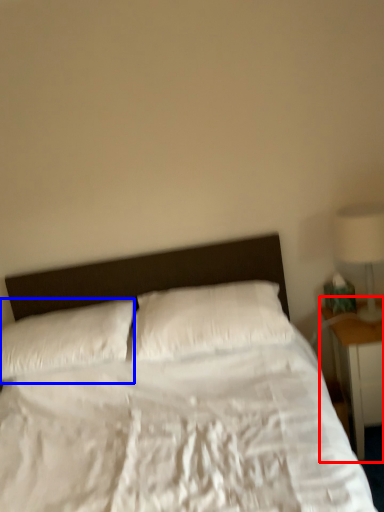
Question: Among these objects, which one is farthest to the camera, nightstand (highlighted by a red box) or pillow (highlighted by a blue box)?

Choices:
 (A) nightstand
 (B) pillow

Answer: (A)